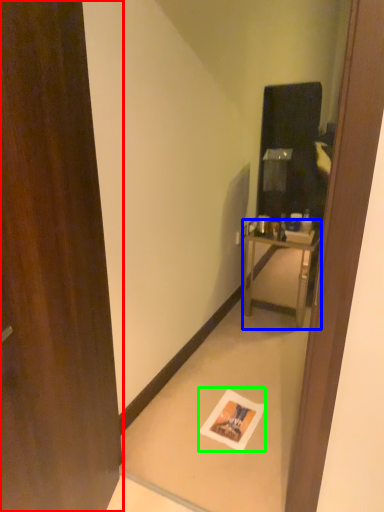
Question: Which object is positioned farthest from door (highlighted by a red box)? Select from nightstand (highlighted by a blue box) and postcard (highlighted by a green box).

Choices:
 (A) nightstand
 (B) postcard

Answer: (A)